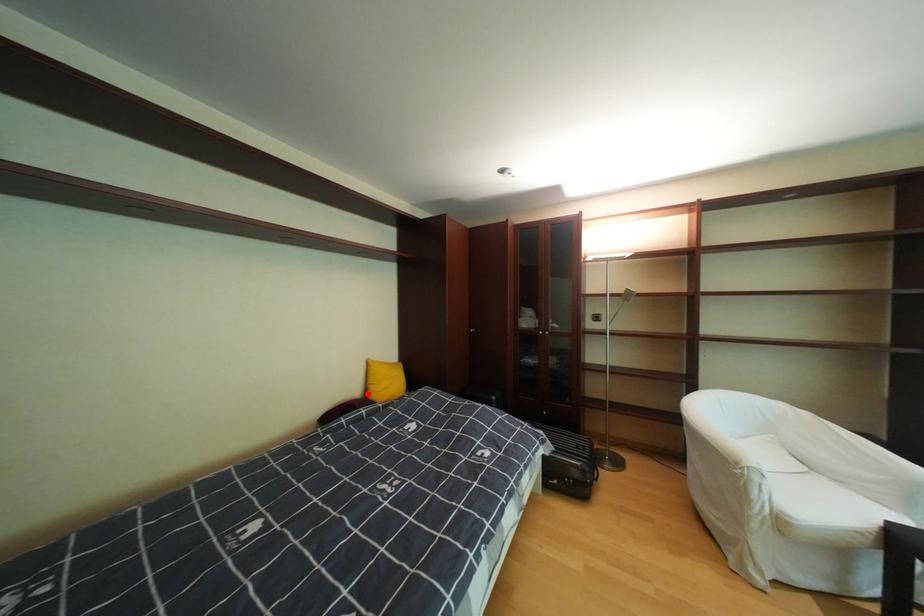
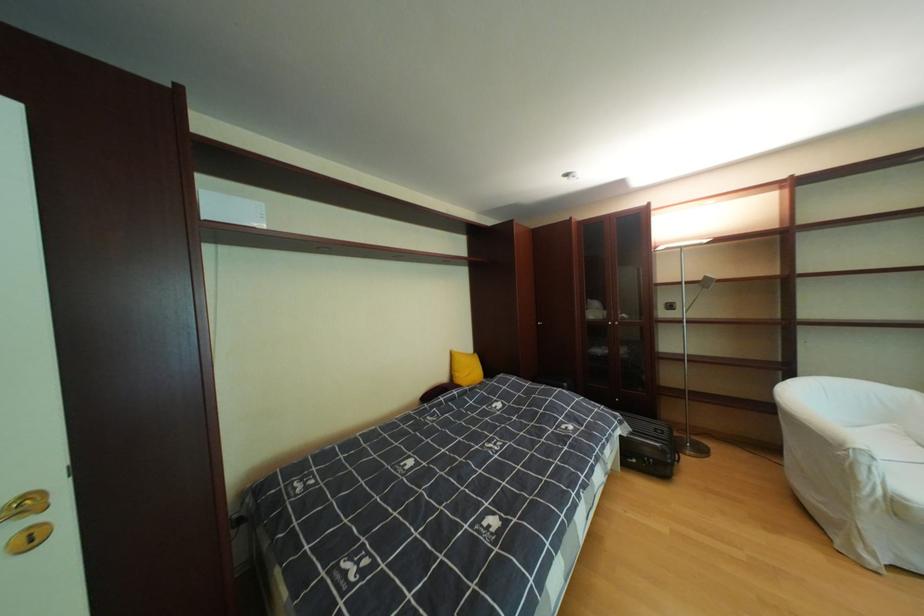
Find the pixel in the second image that matches the highlighted location in the first image.

(456, 379)